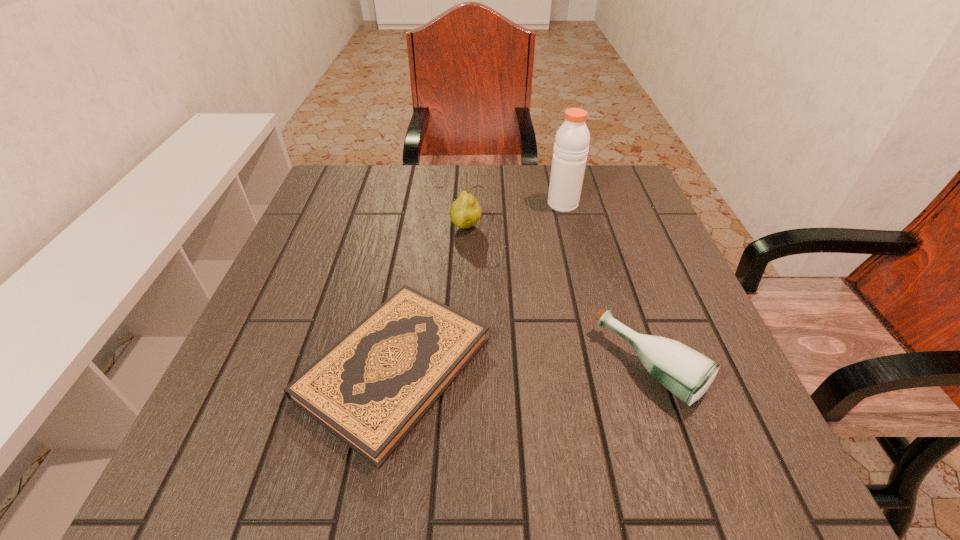
What are the coordinates of `object situated at the far edge` in the screenshot? It's located at (571, 146).

Where is `object located in the near edge section of the desktop`? This screenshot has height=540, width=960. object located in the near edge section of the desktop is located at coordinates (x=370, y=389).

Where is `object that is at the left edge`? This screenshot has width=960, height=540. object that is at the left edge is located at coordinates (370, 389).

Identify the location of object that is at the right edge. The image size is (960, 540). (686, 373).

Locate an element on the screen. This screenshot has width=960, height=540. object that is at the near left corner is located at coordinates (370, 389).

At what (x,y) coordinates should I click in order to perform the action: click on vacant space at the far edge of the desktop. Please return your answer as a coordinate pair (x, y). Image resolution: width=960 pixels, height=540 pixels. Looking at the image, I should click on (427, 202).

In order to click on vacant position at the near edge of the desktop in this screenshot , I will do `click(354, 485)`.

Find the location of `vacant space at the left edge of the desktop`. vacant space at the left edge of the desktop is located at coordinates (318, 346).

In the image, there is a desktop. Where is `blank space at the right edge`? The width and height of the screenshot is (960, 540). blank space at the right edge is located at coordinates [x=620, y=233].

Where is `vacant area between the bottle and the hardback book`? This screenshot has width=960, height=540. vacant area between the bottle and the hardback book is located at coordinates (522, 367).